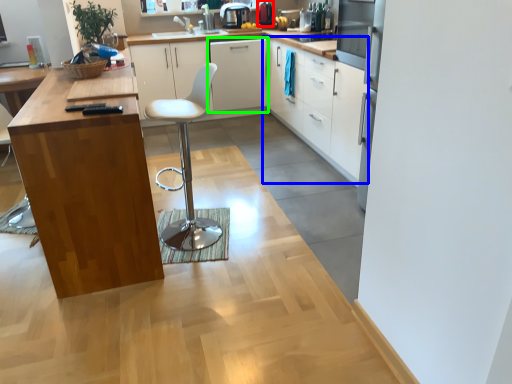
Question: Which is farther away from appliance (highlighted by a red box)? cabinetry (highlighted by a blue box) or cabinetry (highlighted by a green box)?

Choices:
 (A) cabinetry
 (B) cabinetry

Answer: (A)